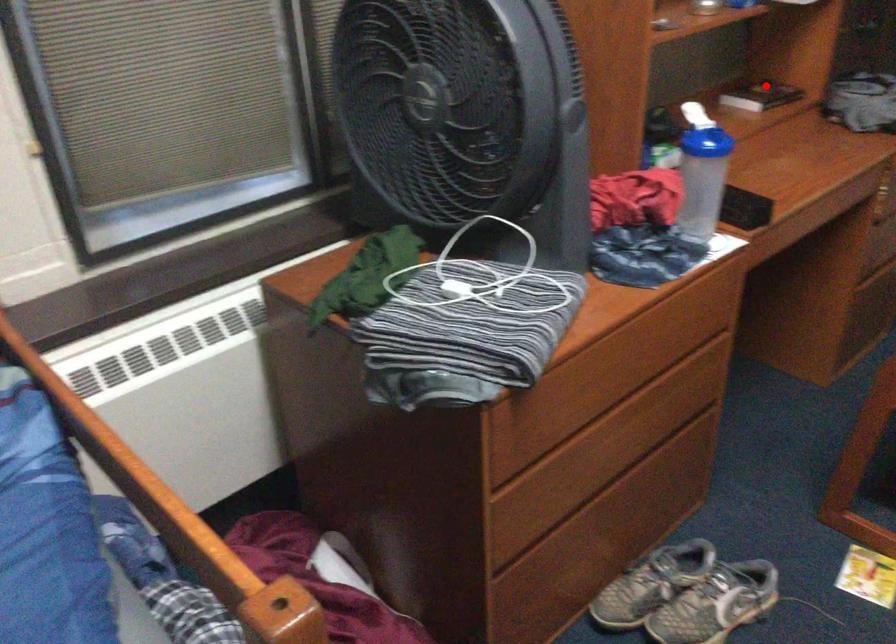
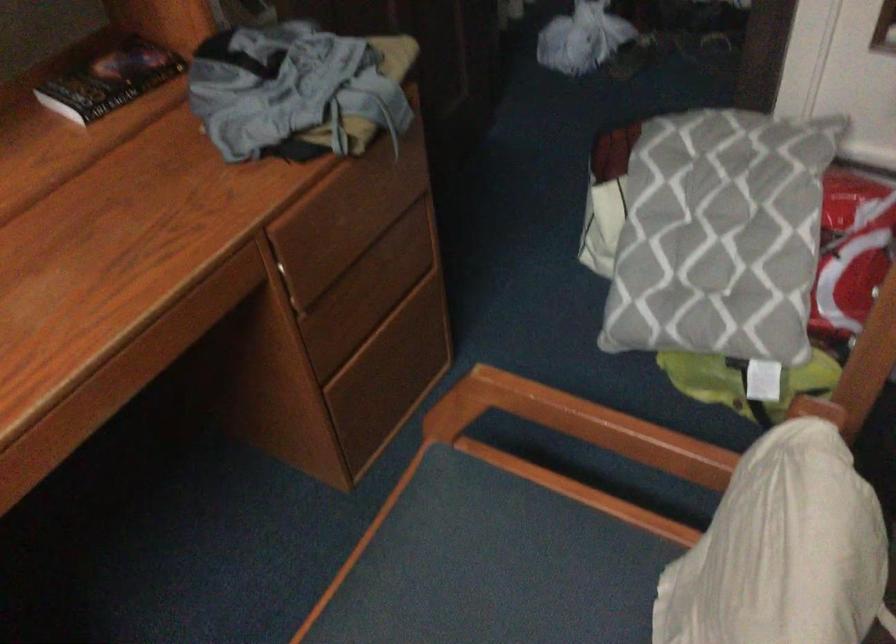
In the second image, find the point that corresponds to the highlighted location in the first image.

(110, 80)